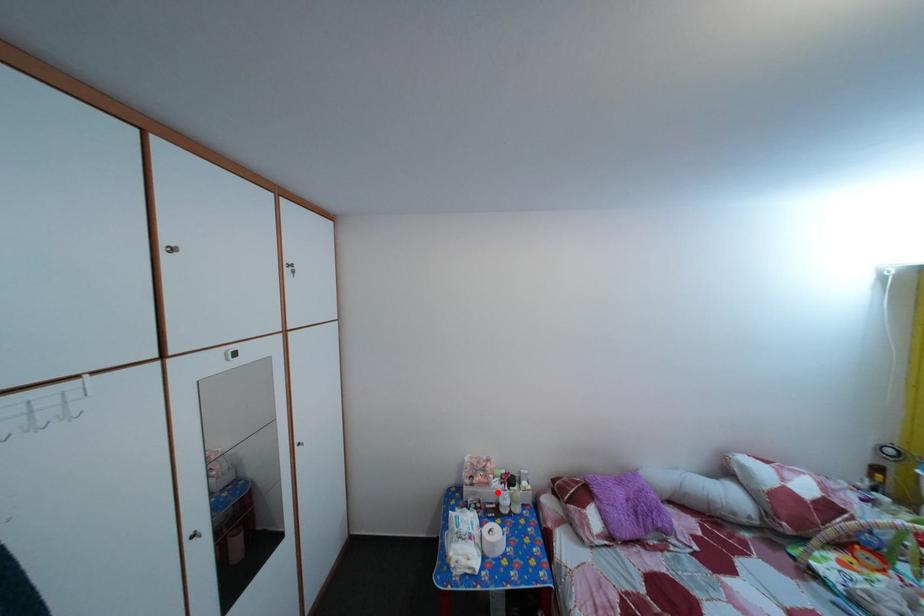
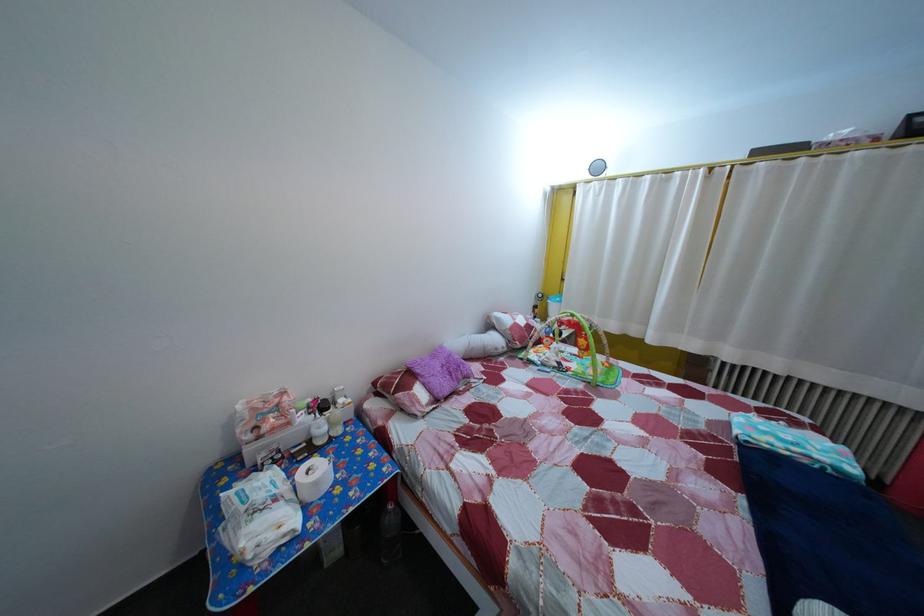
Question: A red point is marked in image1. In image2, is the corresponding 3D point closer to the camera or farther? Reply with the corresponding letter.

Choices:
 (A) The corresponding 3D point is closer.
 (B) The corresponding 3D point is farther.

Answer: (A)